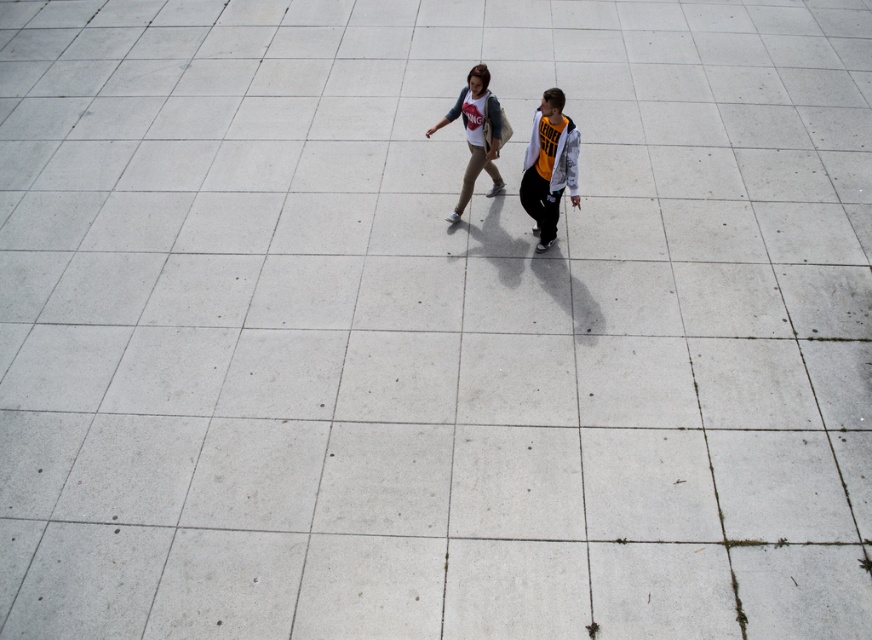
You are a photographer standing behind the two people in the image. You want to take a photo that includes both the orange jersey at center and the matte white shirt at center. Which person should you focus on first if you want to ensure both are in frame?

You should focus on the matte white shirt at center first because it is taller than the orange jersey at center, so positioning the camera to include its height will naturally include the shorter orange jersey at center as well.

You are standing at the origin of a coordinate system placed at the bottom left corner of the image. You see a point marked at coordinates (549, 164). What object is located at that point?

The point at coordinates (549, 164) corresponds to the orange jersey at center.

You are a photographer trying to capture both the orange jersey at center and the matte white shirt at center in a single frame. Based on their sizes in the image, which one should you focus on first to ensure both are clearly visible?

Since the orange jersey at center occupies less space than the matte white shirt at center, you should focus on the orange jersey at center first to ensure it is in clear focus while the larger matte white shirt at center will naturally be more in the frame.